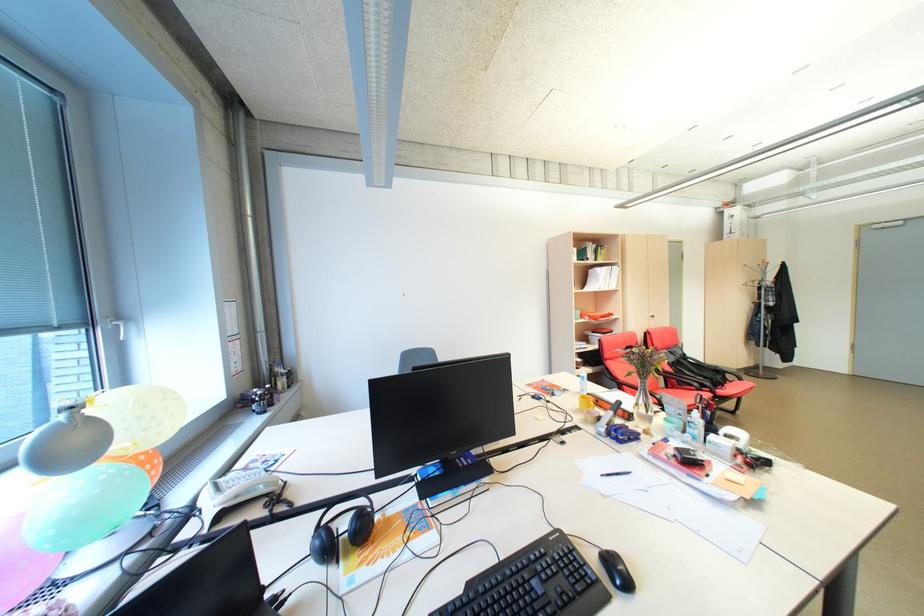
You are a GUI agent. You are given a task and a screenshot of the screen. Output one action in this format:
    pyautogui.click(x=<x>, y=<y>)
    Task: Click on the glass vase
    This screenshot has width=924, height=616.
    Given the screenshot: What is the action you would take?
    pyautogui.click(x=642, y=379)